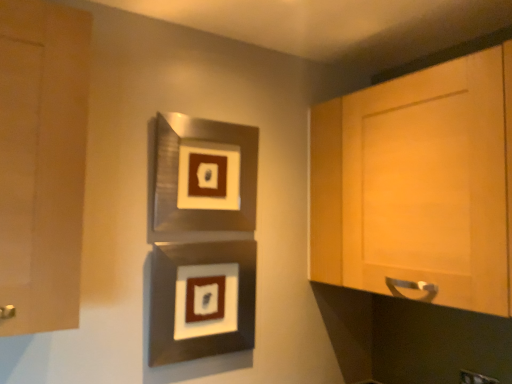
Question: Considering the relative sizes of metallic silver picture frame at center, positioned as the 2th picture frame in top-to-bottom order, and metallic silver picture frame at center, which ranks as the first picture frame in top-to-bottom order, in the image provided, is metallic silver picture frame at center, positioned as the 2th picture frame in top-to-bottom order, bigger than metallic silver picture frame at center, which ranks as the first picture frame in top-to-bottom order,?

Choices:
 (A) yes
 (B) no

Answer: (B)

Question: Is metallic silver picture frame at center, positioned as the 2th picture frame in top-to-bottom order, not close to metallic silver picture frame at center, which ranks as the first picture frame in top-to-bottom order?

Choices:
 (A) yes
 (B) no

Answer: (B)

Question: Is metallic silver picture frame at center, positioned as the 2th picture frame in top-to-bottom order, outside metallic silver picture frame at center, which ranks as the first picture frame in top-to-bottom order?

Choices:
 (A) yes
 (B) no

Answer: (A)

Question: Considering the relative sizes of metallic silver picture frame at center, positioned as the 2th picture frame in top-to-bottom order, and metallic silver picture frame at center, which ranks as the first picture frame in top-to-bottom order, in the image provided, is metallic silver picture frame at center, positioned as the 2th picture frame in top-to-bottom order, smaller than metallic silver picture frame at center, which ranks as the first picture frame in top-to-bottom order,?

Choices:
 (A) yes
 (B) no

Answer: (A)

Question: Does metallic silver picture frame at center, the first picture frame positioned from the bottom, have a greater height compared to metallic silver picture frame at center, which ranks as the first picture frame in top-to-bottom order?

Choices:
 (A) yes
 (B) no

Answer: (B)

Question: From the image's perspective, is metallic silver picture frame at center, the first picture frame positioned from the bottom, on top of metallic silver picture frame at center, which ranks as the first picture frame in top-to-bottom order?

Choices:
 (A) yes
 (B) no

Answer: (B)

Question: Considering the relative sizes of light wood cabinet at right, which ranks as the second cabinetry in left-to-right order, and metallic silver picture frame at center, which ranks as the first picture frame in top-to-bottom order, in the image provided, is light wood cabinet at right, which ranks as the second cabinetry in left-to-right order, wider than metallic silver picture frame at center, which ranks as the first picture frame in top-to-bottom order,?

Choices:
 (A) no
 (B) yes

Answer: (B)

Question: Is light wood cabinet at right, which ranks as the second cabinetry in left-to-right order, next to metallic silver picture frame at center, which ranks as the second picture frame in bottom-to-top order?

Choices:
 (A) no
 (B) yes

Answer: (A)

Question: Does light wood cabinet at right, the 1th cabinetry in the right-to-left sequence, have a greater height compared to metallic silver picture frame at center, which ranks as the second picture frame in bottom-to-top order?

Choices:
 (A) yes
 (B) no

Answer: (A)

Question: From a real-world perspective, does light wood cabinet at right, which ranks as the second cabinetry in left-to-right order, stand above metallic silver picture frame at center, which ranks as the first picture frame in top-to-bottom order?

Choices:
 (A) yes
 (B) no

Answer: (B)

Question: Can you confirm if light wood cabinet at right, the 1th cabinetry in the right-to-left sequence, is thinner than metallic silver picture frame at center, which ranks as the second picture frame in bottom-to-top order?

Choices:
 (A) no
 (B) yes

Answer: (A)

Question: Is light wood cabinet at right, which ranks as the second cabinetry in left-to-right order, behind metallic silver picture frame at center, which ranks as the first picture frame in top-to-bottom order?

Choices:
 (A) yes
 (B) no

Answer: (B)

Question: Is matte wood cabinet at left, the second cabinetry positioned from the right, located within metallic silver picture frame at center, the first picture frame positioned from the bottom?

Choices:
 (A) no
 (B) yes

Answer: (A)